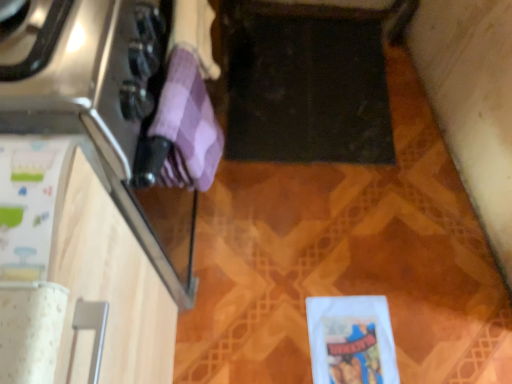
Find the location of `empty space that is ontop of white matte wrapping paper at lower right, placed as the first wrapping paper when sorted from right to left (from a real-world perspective)`. empty space that is ontop of white matte wrapping paper at lower right, placed as the first wrapping paper when sorted from right to left (from a real-world perspective) is located at coordinates 356,345.